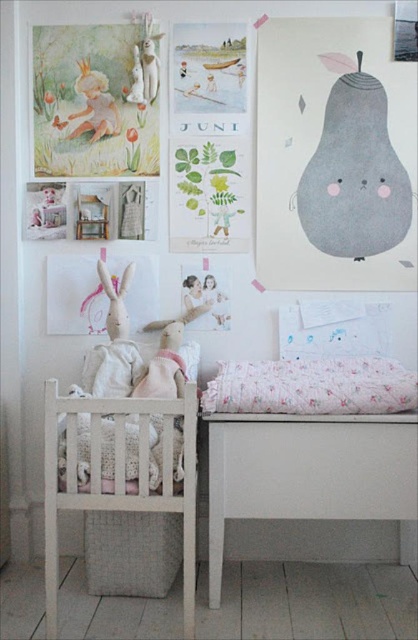
Question: Which of these objects is positioned closest to the white wooden crib at lower left?

Choices:
 (A) matte white bunny at upper left
 (B) white fabric infant bed at lower right

Answer: (B)

Question: Which object is closer to the camera taking this photo?

Choices:
 (A) white fabric infant bed at lower right
 (B) fluffy white pillow at lower center
 (C) white wooden crib at lower left

Answer: (C)

Question: Is white fabric infant bed at lower right closer to camera compared to fluffy white pillow at lower center?

Choices:
 (A) yes
 (B) no

Answer: (A)

Question: Is white fabric infant bed at lower right thinner than white wooden crib at lower left?

Choices:
 (A) yes
 (B) no

Answer: (B)

Question: Can you confirm if white fabric infant bed at lower right is positioned to the left of matte white bunny at upper left?

Choices:
 (A) no
 (B) yes

Answer: (A)

Question: Which is farther from the fluffy white pillow at lower center?

Choices:
 (A) matte white bunny at upper left
 (B) white fabric infant bed at lower right
 (C) white wooden crib at lower left

Answer: (A)